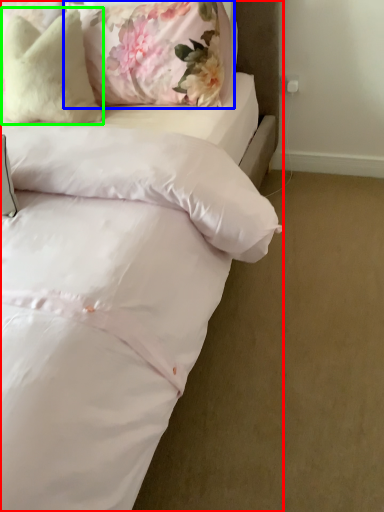
Question: Estimate the real-world distances between objects in this image. Which object is farther from bed (highlighted by a red box), pillow (highlighted by a blue box) or pillow (highlighted by a green box)?

Choices:
 (A) pillow
 (B) pillow

Answer: (B)